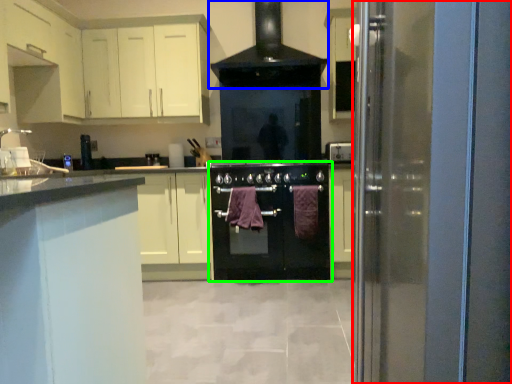
Question: Based on their relative distances, which object is nearer to glass door (highlighted by a red box)? Choose from home appliance (highlighted by a blue box) and oven (highlighted by a green box).

Choices:
 (A) home appliance
 (B) oven

Answer: (B)